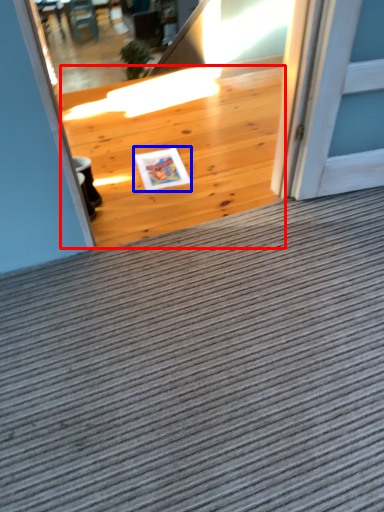
Question: Which object is closer to the camera taking this photo, hardwood (highlighted by a red box) or postcard (highlighted by a blue box)?

Choices:
 (A) hardwood
 (B) postcard

Answer: (A)